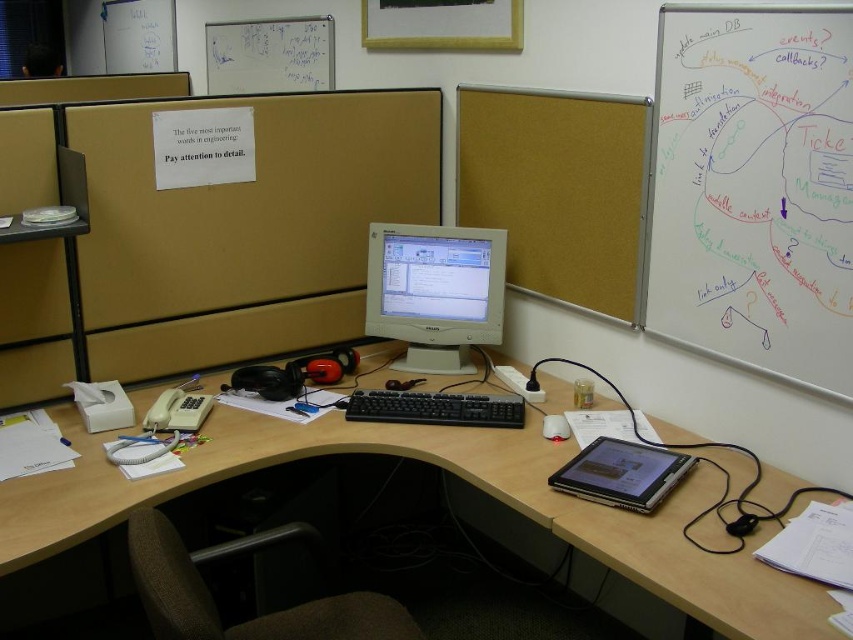
Question: Among these objects, which one is nearest to the camera?

Choices:
 (A) black plastic keyboard at center
 (B) silver metallic laptop at right
 (C) black plastic computer desk at center
 (D) whiteboard at upper right

Answer: (C)

Question: Which object is positioned farthest from the black plastic keyboard at center?

Choices:
 (A) matte gray monitor at center
 (B) white matte mouse at center
 (C) silver metallic laptop at right
 (D) whiteboard at upper right

Answer: (D)

Question: Is brown felt at upper right bigger than black plastic keyboard at center?

Choices:
 (A) yes
 (B) no

Answer: (A)

Question: Estimate the real-world distances between objects in this image. Which object is farther from the brown felt at upper right?

Choices:
 (A) silver metallic laptop at right
 (B) black plastic computer desk at center
 (C) black plastic keyboard at center

Answer: (A)

Question: Does brown felt at upper right appear on the right side of silver metallic laptop at right?

Choices:
 (A) no
 (B) yes

Answer: (A)

Question: Is whiteboard at upper right wider than white matte mouse at center?

Choices:
 (A) no
 (B) yes

Answer: (B)